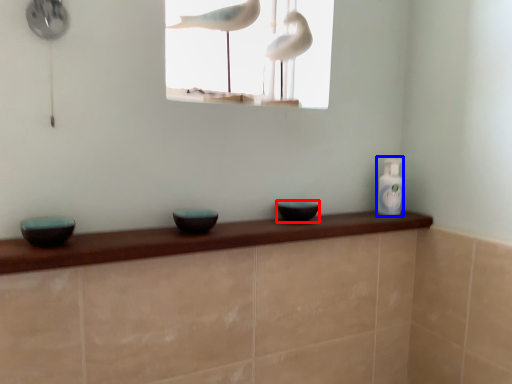
Question: Which of the following is the closest to the observer, basin (highlighted by a red box) or bottle (highlighted by a blue box)?

Choices:
 (A) basin
 (B) bottle

Answer: (A)